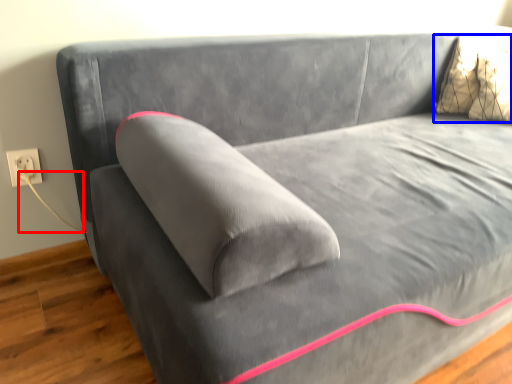
Question: Which object is further to the camera taking this photo, string (highlighted by a red box) or pillow (highlighted by a blue box)?

Choices:
 (A) string
 (B) pillow

Answer: (B)